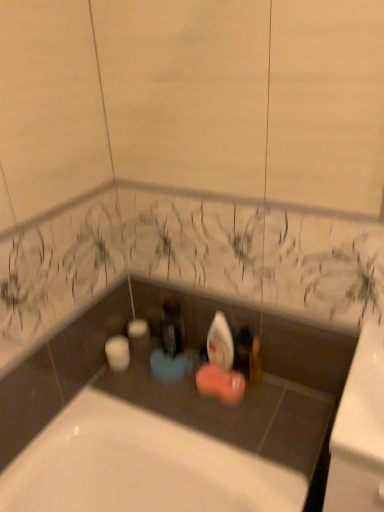
Question: Does point (256, 351) appear closer or farther from the camera than point (173, 356)?

Choices:
 (A) closer
 (B) farther

Answer: (A)

Question: Based on their positions, is matte gold soap at center located to the left or right of matte black bottle at center?

Choices:
 (A) right
 (B) left

Answer: (A)

Question: From a real-world perspective, is matte gold soap at center positioned above or below matte black bottle at center?

Choices:
 (A) above
 (B) below

Answer: (B)

Question: Would you say matte black bottle at center is to the left or to the right of matte gold soap at center in the picture?

Choices:
 (A) left
 (B) right

Answer: (A)

Question: From a real-world perspective, is matte black bottle at center positioned above or below matte gold soap at center?

Choices:
 (A) above
 (B) below

Answer: (A)

Question: Considering their positions, is matte black bottle at center located in front of or behind matte gold soap at center?

Choices:
 (A) front
 (B) behind

Answer: (B)

Question: Looking at the image, does matte black bottle at center seem bigger or smaller compared to matte gold soap at center?

Choices:
 (A) small
 (B) big

Answer: (B)